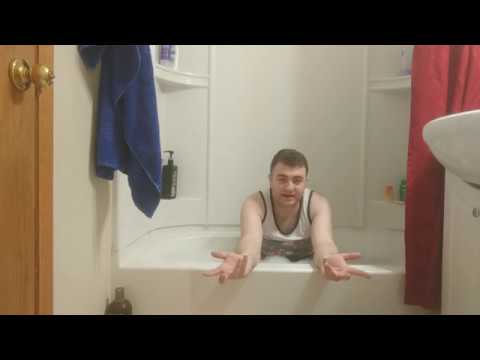
Locate an element on the screen. Image resolution: width=480 pixels, height=360 pixels. shelf is located at coordinates (183, 76), (182, 193), (381, 85), (377, 198).